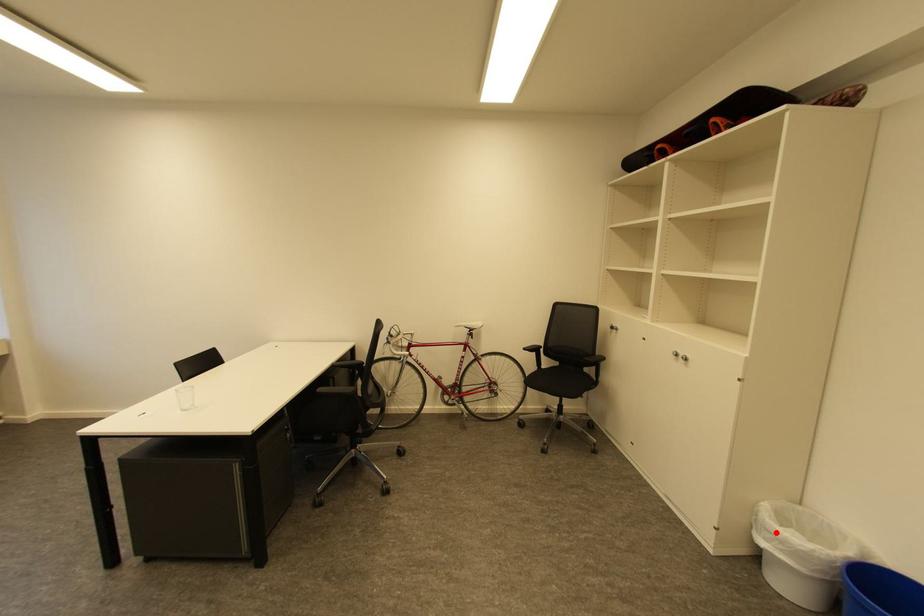
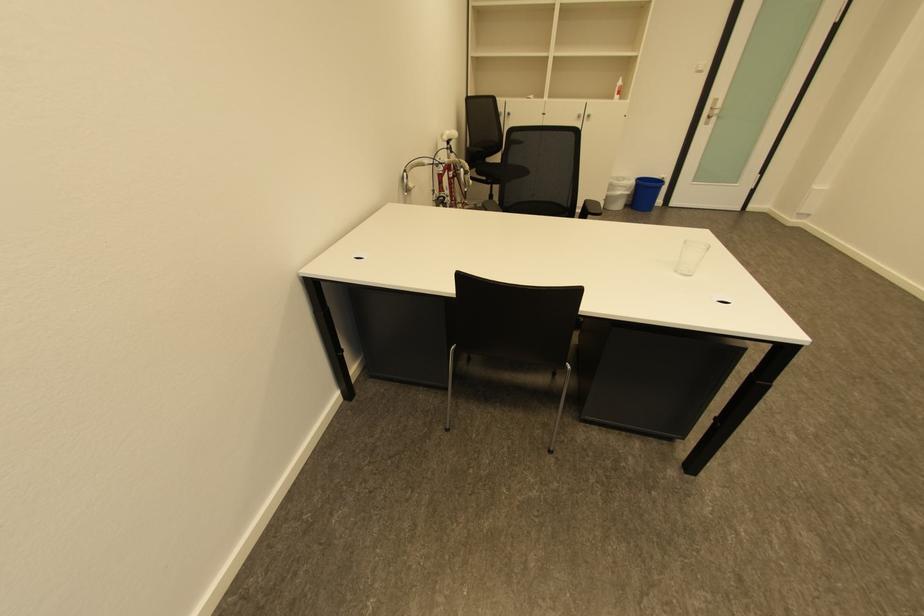
Question: A red point is marked in image1. In image2, is the corresponding 3D point closer to the camera or farther? Reply with the corresponding letter.

Choices:
 (A) The corresponding 3D point is closer.
 (B) The corresponding 3D point is farther.

Answer: (A)